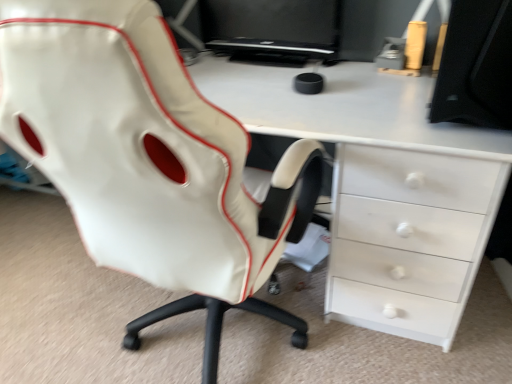
Question: From the image's perspective, is black glossy monitor at upper center on white leather chair at center?

Choices:
 (A) yes
 (B) no

Answer: (A)

Question: Can you confirm if black glossy monitor at upper center is wider than white leather chair at center?

Choices:
 (A) no
 (B) yes

Answer: (A)

Question: Is white leather chair at center inside black glossy monitor at upper center?

Choices:
 (A) yes
 (B) no

Answer: (B)

Question: Considering the relative sizes of black glossy monitor at upper center and white leather chair at center in the image provided, is black glossy monitor at upper center taller than white leather chair at center?

Choices:
 (A) yes
 (B) no

Answer: (B)

Question: Is black glossy monitor at upper center shorter than white leather chair at center?

Choices:
 (A) yes
 (B) no

Answer: (A)

Question: Would you say black glossy monitor at upper center is outside white leather chair at center?

Choices:
 (A) no
 (B) yes

Answer: (B)

Question: From a real-world perspective, is black matte monitor at upper right over white glossy desk at center?

Choices:
 (A) yes
 (B) no

Answer: (A)

Question: Is black matte monitor at upper right at the left side of white glossy desk at center?

Choices:
 (A) yes
 (B) no

Answer: (B)

Question: Would you say black matte monitor at upper right is outside white glossy desk at center?

Choices:
 (A) no
 (B) yes

Answer: (B)

Question: Is white glossy desk at center completely or partially inside black matte monitor at upper right?

Choices:
 (A) yes
 (B) no

Answer: (B)

Question: Is black matte monitor at upper right closer to the viewer compared to white glossy desk at center?

Choices:
 (A) no
 (B) yes

Answer: (B)

Question: Is black matte monitor at upper right placed right next to white glossy desk at center?

Choices:
 (A) yes
 (B) no

Answer: (B)

Question: Can we say black matte monitor at upper right lies outside black glossy monitor at upper center?

Choices:
 (A) yes
 (B) no

Answer: (A)